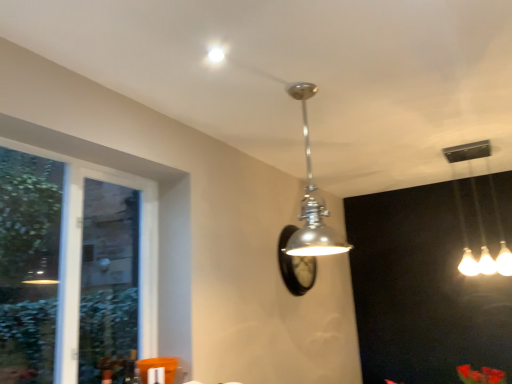
The height and width of the screenshot is (384, 512). What do you see at coordinates (481, 375) in the screenshot?
I see `rubberized plastic flowers at center` at bounding box center [481, 375].

Identify the location of white glossy light fixture at upper right, the 2th lamp when ordered from left to right. Image resolution: width=512 pixels, height=384 pixels. (478, 215).

Image resolution: width=512 pixels, height=384 pixels. What do you see at coordinates (478, 215) in the screenshot?
I see `white glossy light fixture at upper right, placed as the 1th lamp when sorted from back to front` at bounding box center [478, 215].

What are the coordinates of `polished chrome pendant light at center, the first lamp in the front-to-back sequence` in the screenshot? It's located at (312, 199).

The width and height of the screenshot is (512, 384). I want to click on clear glass window at left, so click(158, 221).

At what (x,y) coordinates should I click in order to perform the action: click on rubberized plastic flowers at center. Please return your answer as a coordinate pair (x, y). The image size is (512, 384). Looking at the image, I should click on (481, 375).

Between matte silver droplight at upper center and polished chrome pendant light at center, positioned as the second lamp in back-to-front order, which one has smaller width?

matte silver droplight at upper center.

In terms of size, does matte silver droplight at upper center appear bigger or smaller than polished chrome pendant light at center, which is counted as the first lamp, starting from the left?

matte silver droplight at upper center is smaller than polished chrome pendant light at center, which is counted as the first lamp, starting from the left.

Is matte silver droplight at upper center taller than polished chrome pendant light at center, the first lamp in the front-to-back sequence?

In fact, matte silver droplight at upper center may be shorter than polished chrome pendant light at center, the first lamp in the front-to-back sequence.

Does point (217, 61) come behind point (307, 143)?

That is False.

Can you confirm if matte silver droplight at upper center is shorter than rubberized plastic flowers at center?

Yes.

This screenshot has width=512, height=384. Identify the location of flower that is under the matte silver droplight at upper center (from a real-world perspective). [481, 375].

Can you confirm if rubberized plastic flowers at center is bigger than polished chrome pendant light at center, positioned as the second lamp in back-to-front order?

Incorrect, rubberized plastic flowers at center is not larger than polished chrome pendant light at center, positioned as the second lamp in back-to-front order.

Is rubberized plastic flowers at center further to the viewer compared to polished chrome pendant light at center, the first lamp in the front-to-back sequence?

Yes, rubberized plastic flowers at center is behind polished chrome pendant light at center, the first lamp in the front-to-back sequence.

Looking at this image, is rubberized plastic flowers at center inside or outside of polished chrome pendant light at center, the first lamp in the front-to-back sequence?

rubberized plastic flowers at center is outside polished chrome pendant light at center, the first lamp in the front-to-back sequence.

Measure the distance from rubberized plastic flowers at center to polished chrome pendant light at center, which is the 2th lamp in right-to-left order.

A distance of 4.88 feet exists between rubberized plastic flowers at center and polished chrome pendant light at center, which is the 2th lamp in right-to-left order.

From the image's perspective, between matte silver droplight at upper center and clear glass window at left, which one is located above?

matte silver droplight at upper center is shown above in the image.

Considering the relative sizes of matte silver droplight at upper center and clear glass window at left in the image provided, is matte silver droplight at upper center shorter than clear glass window at left?

Indeed, matte silver droplight at upper center has a lesser height compared to clear glass window at left.

Between matte silver droplight at upper center and clear glass window at left, which one appears on the right side from the viewer's perspective?

Positioned to the right is matte silver droplight at upper center.

Which is correct: matte silver droplight at upper center is inside clear glass window at left, or outside of it?

matte silver droplight at upper center cannot be found inside clear glass window at left.

Does rubberized plastic flowers at center turn towards matte silver droplight at upper center?

No, rubberized plastic flowers at center is not turned towards matte silver droplight at upper center.

Visually, is rubberized plastic flowers at center positioned to the left or to the right of matte silver droplight at upper center?

In the image, rubberized plastic flowers at center appears on the right side of matte silver droplight at upper center.

Is matte silver droplight at upper center completely or partially inside rubberized plastic flowers at center?

Definitely not — matte silver droplight at upper center is not inside rubberized plastic flowers at center.

Between rubberized plastic flowers at center and matte silver droplight at upper center, which one has larger size?

rubberized plastic flowers at center is bigger.

What's the angular difference between polished chrome pendant light at center, which is counted as the first lamp, starting from the left, and clear glass window at left's facing directions?

The facing directions of polished chrome pendant light at center, which is counted as the first lamp, starting from the left, and clear glass window at left are 90 degrees apart.

From the image's perspective, is polished chrome pendant light at center, which is counted as the first lamp, starting from the left, above clear glass window at left?

Yes, from the image's perspective, polished chrome pendant light at center, which is counted as the first lamp, starting from the left, is on top of clear glass window at left.

Consider the image. From a real-world perspective, which is physically below, polished chrome pendant light at center, which is the 2th lamp in right-to-left order, or clear glass window at left?

clear glass window at left is physically lower.

In order to click on the 2nd lamp positioned above the clear glass window at left (from a real-world perspective) in this screenshot , I will do `click(312, 199)`.

Is the position of white glossy light fixture at upper right, which ranks as the first lamp in right-to-left order, more distant than that of matte silver droplight at upper center?

Yes, it is behind matte silver droplight at upper center.

Considering the sizes of objects white glossy light fixture at upper right, which appears as the 2th lamp when viewed from the front, and matte silver droplight at upper center in the image provided, who is bigger, white glossy light fixture at upper right, which appears as the 2th lamp when viewed from the front, or matte silver droplight at upper center?

white glossy light fixture at upper right, which appears as the 2th lamp when viewed from the front, is bigger.

Is white glossy light fixture at upper right, the 2th lamp when ordered from left to right, aimed at matte silver droplight at upper center?

No, white glossy light fixture at upper right, the 2th lamp when ordered from left to right, is not facing towards matte silver droplight at upper center.

Between white glossy light fixture at upper right, which ranks as the first lamp in right-to-left order, and matte silver droplight at upper center, which one has more height?

white glossy light fixture at upper right, which ranks as the first lamp in right-to-left order, is taller.

Identify the location of the 1st lamp to the right when counting from the matte silver droplight at upper center. (312, 199).

Locate an element on the screen. The image size is (512, 384). droplight on the left of the rubberized plastic flowers at center is located at coordinates (216, 54).

When comparing their distances from clear glass window at left, does rubberized plastic flowers at center or matte silver droplight at upper center seem closer?

Based on the image, matte silver droplight at upper center appears to be nearer to clear glass window at left.

From the image, which object appears to be farther from white glossy light fixture at upper right, the 2th lamp when ordered from left to right, clear glass window at left or matte silver droplight at upper center?

Among the two, matte silver droplight at upper center is located further to white glossy light fixture at upper right, the 2th lamp when ordered from left to right.

From the image, which object appears to be nearer to matte silver droplight at upper center, white glossy light fixture at upper right, the 2th lamp when ordered from left to right, or polished chrome pendant light at center, which is the 2th lamp in right-to-left order?

The object closer to matte silver droplight at upper center is polished chrome pendant light at center, which is the 2th lamp in right-to-left order.

Considering their positions, is polished chrome pendant light at center, the first lamp in the front-to-back sequence, positioned closer to clear glass window at left than white glossy light fixture at upper right, placed as the 1th lamp when sorted from back to front?

Among the two, polished chrome pendant light at center, the first lamp in the front-to-back sequence, is located nearer to clear glass window at left.

When comparing their distances from white glossy light fixture at upper right, which appears as the 2th lamp when viewed from the front, does polished chrome pendant light at center, the first lamp in the front-to-back sequence, or matte silver droplight at upper center seem further?

Based on the image, matte silver droplight at upper center appears to be further to white glossy light fixture at upper right, which appears as the 2th lamp when viewed from the front.

Based on their spatial positions, is clear glass window at left or white glossy light fixture at upper right, which ranks as the first lamp in right-to-left order, closer to matte silver droplight at upper center?

clear glass window at left lies closer to matte silver droplight at upper center than the other object.

Estimate the real-world distances between objects in this image. Which object is closer to clear glass window at left, matte silver droplight at upper center or white glossy light fixture at upper right, which appears as the 2th lamp when viewed from the front?

matte silver droplight at upper center.

When comparing their distances from polished chrome pendant light at center, positioned as the second lamp in back-to-front order, does clear glass window at left or rubberized plastic flowers at center seem closer?

Based on the image, clear glass window at left appears to be nearer to polished chrome pendant light at center, positioned as the second lamp in back-to-front order.

I want to click on lamp situated between clear glass window at left and white glossy light fixture at upper right, which appears as the 2th lamp when viewed from the front, from left to right, so click(x=312, y=199).

This screenshot has height=384, width=512. Identify the location of lamp between clear glass window at left and rubberized plastic flowers at center. (312, 199).

Identify the location of flower located between polished chrome pendant light at center, which is counted as the first lamp, starting from the left, and white glossy light fixture at upper right, which appears as the 2th lamp when viewed from the front, in the left-right direction. (481, 375).

At what (x,y) coordinates should I click in order to perform the action: click on droplight located between clear glass window at left and rubberized plastic flowers at center in the left-right direction. Please return your answer as a coordinate pair (x, y). This screenshot has height=384, width=512. Looking at the image, I should click on (216, 54).